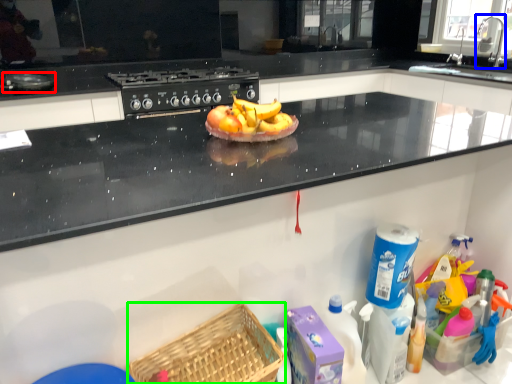
Question: Which object is the closest to the appliance (highlighted by a red box)? Choose among these: faucet (highlighted by a blue box) or basket (highlighted by a green box).

Choices:
 (A) faucet
 (B) basket

Answer: (B)